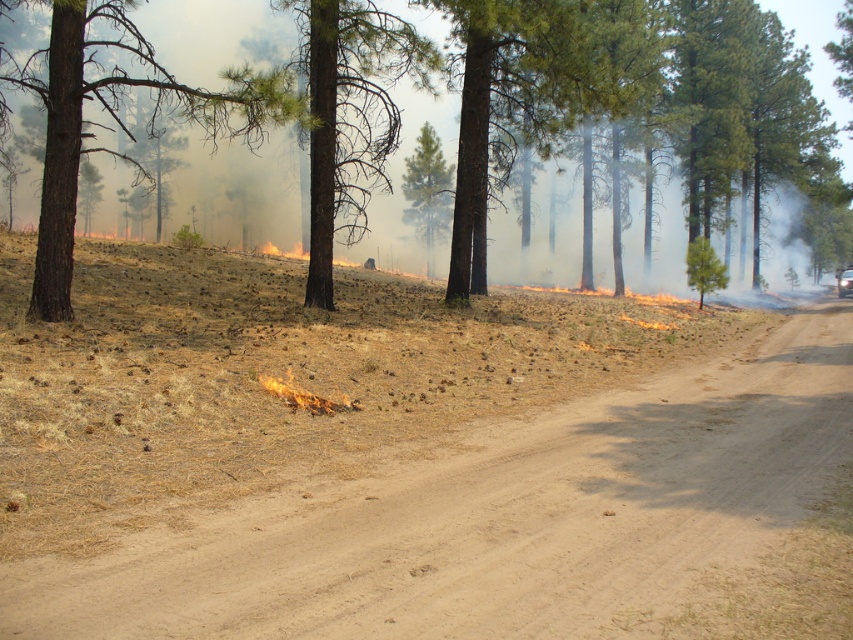
Is point (175, 577) closer to viewer compared to point (549, 83)?

Yes, it is in front of point (549, 83).

Can you confirm if brown sandy dirt track at center is bigger than green textured pine tree at center?

No, brown sandy dirt track at center is not bigger than green textured pine tree at center.

The height and width of the screenshot is (640, 853). What do you see at coordinates (498, 518) in the screenshot?
I see `brown sandy dirt track at center` at bounding box center [498, 518].

You are a GUI agent. You are given a task and a screenshot of the screen. Output one action in this format:
    pyautogui.click(x=<x>, y=<y>)
    Task: Click on the brown sandy dirt track at center
    The image size is (853, 640).
    Given the screenshot: What is the action you would take?
    pyautogui.click(x=498, y=518)

Who is positioned more to the left, brown sandy dirt track at center or flaming yellow-orange fire at center?

flaming yellow-orange fire at center

You are a GUI agent. You are given a task and a screenshot of the screen. Output one action in this format:
    pyautogui.click(x=<x>, y=<y>)
    Task: Click on the brown sandy dirt track at center
    This screenshot has height=640, width=853.
    Given the screenshot: What is the action you would take?
    tap(498, 518)

What do you see at coordinates (498, 518) in the screenshot?
I see `brown sandy dirt track at center` at bounding box center [498, 518].

You are a GUI agent. You are given a task and a screenshot of the screen. Output one action in this format:
    pyautogui.click(x=<x>, y=<y>)
    Task: Click on the brown sandy dirt track at center
    Image resolution: width=853 pixels, height=640 pixels.
    Given the screenshot: What is the action you would take?
    pyautogui.click(x=498, y=518)

Who is higher up, brown sandy dirt track at center or brown rough bark tree at left?

brown rough bark tree at left is higher up.

What do you see at coordinates (498, 518) in the screenshot? This screenshot has height=640, width=853. I see `brown sandy dirt track at center` at bounding box center [498, 518].

Identify the location of brown sandy dirt track at center. (498, 518).

Where is `brown sandy dirt track at center`? brown sandy dirt track at center is located at coordinates (498, 518).